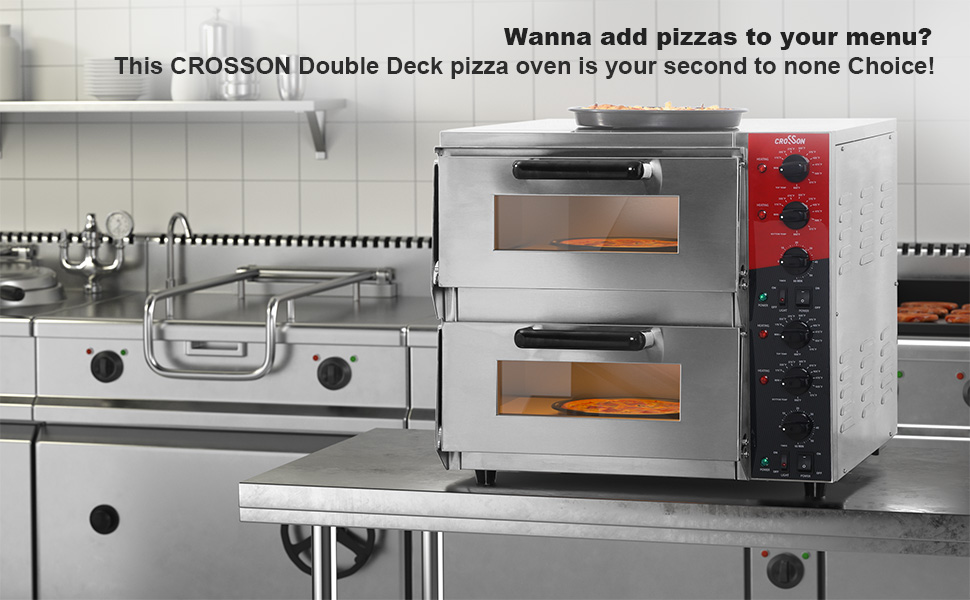
Find the location of a particular element. This screenshot has height=600, width=970. tray is located at coordinates (936, 331).